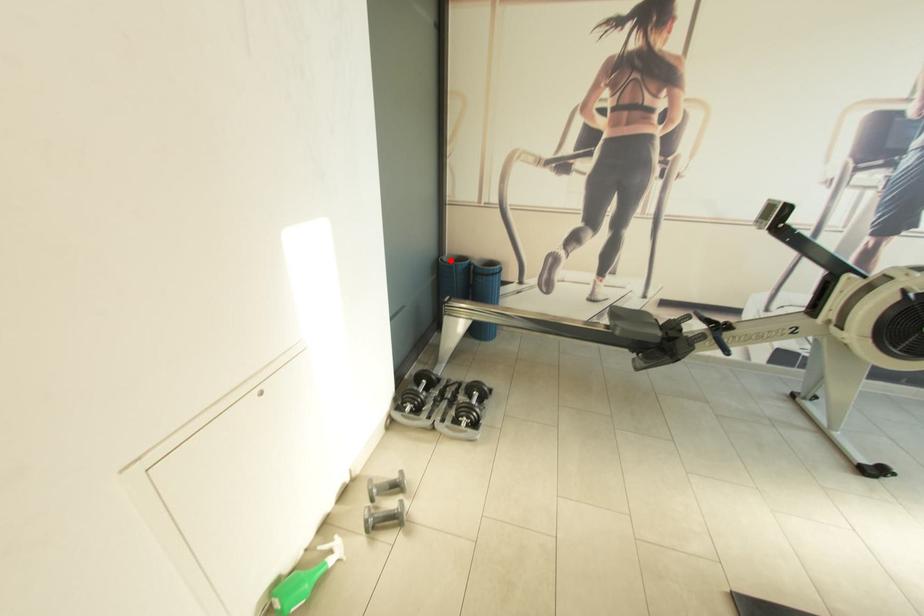
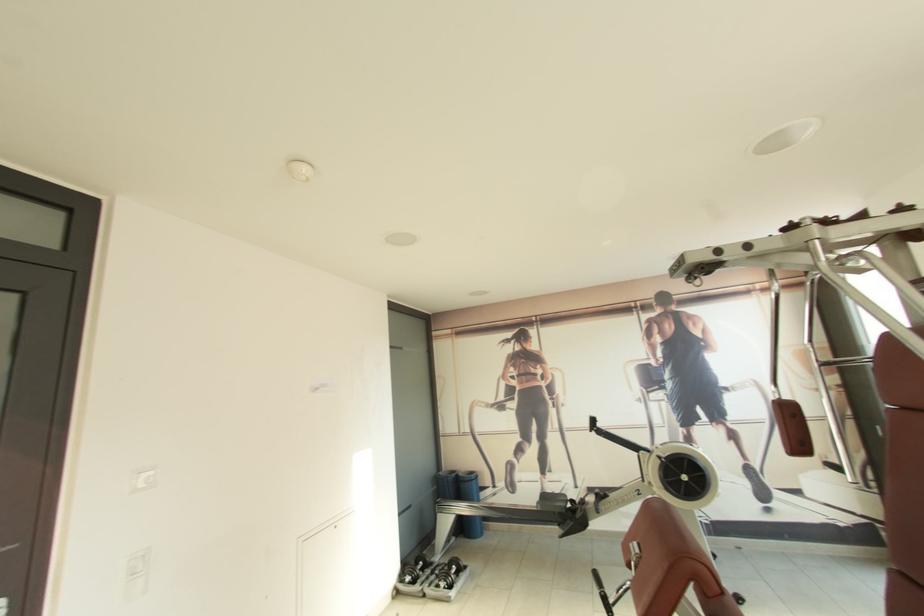
In the second image, find the point that corresponds to the highlighted location in the first image.

(445, 475)